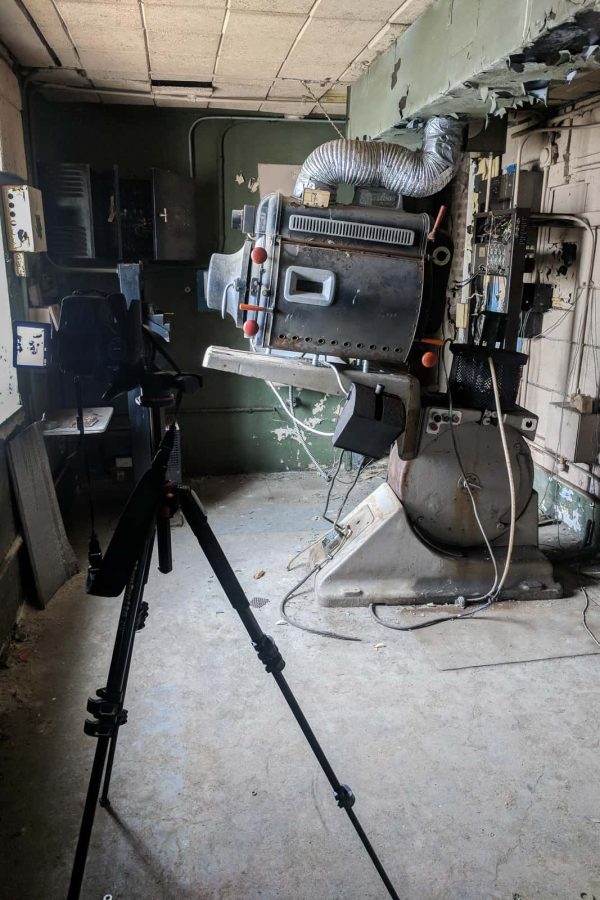
I want to click on white wall unit, so click(x=26, y=212), click(x=26, y=788).